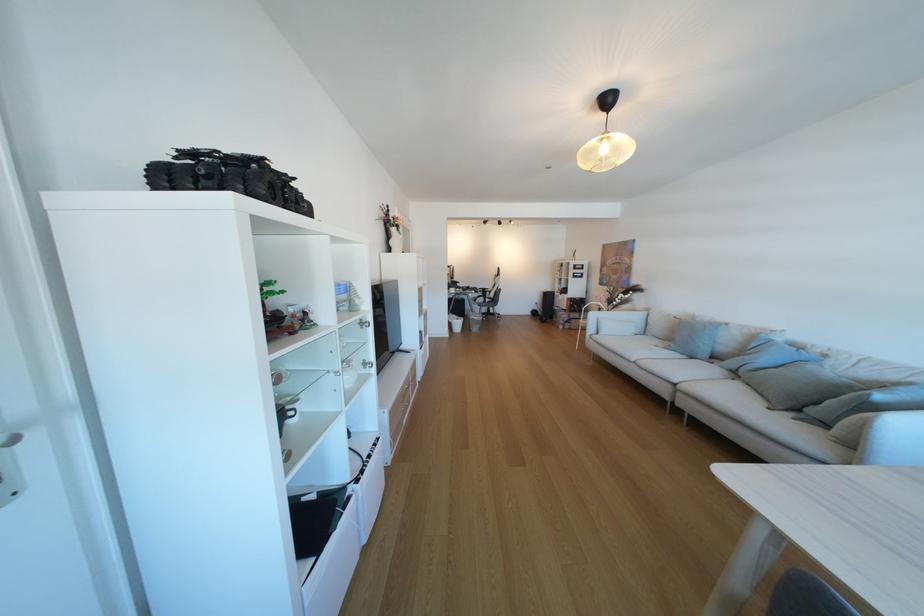
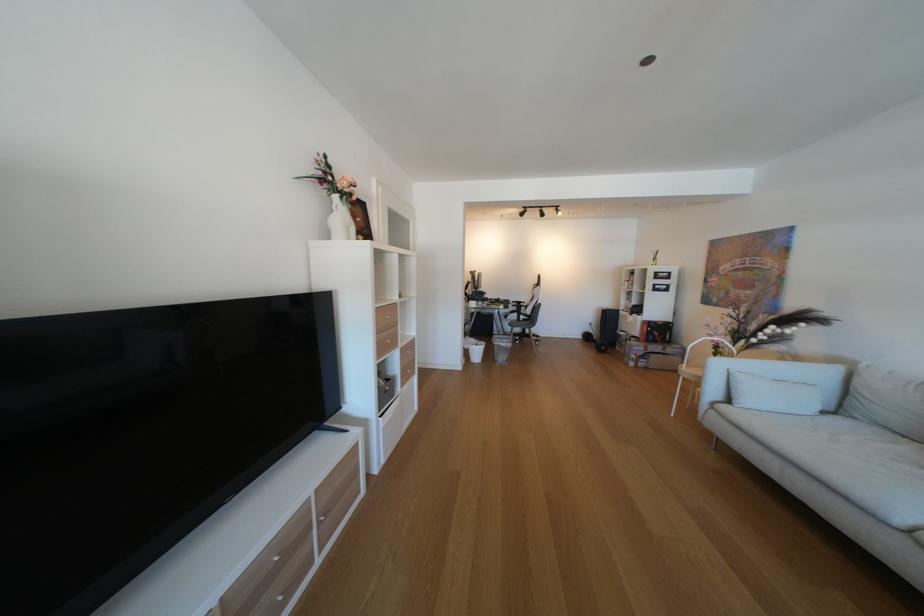
The point at (x=431, y=302) is marked in the first image. Where is the corresponding point in the second image?

(390, 331)